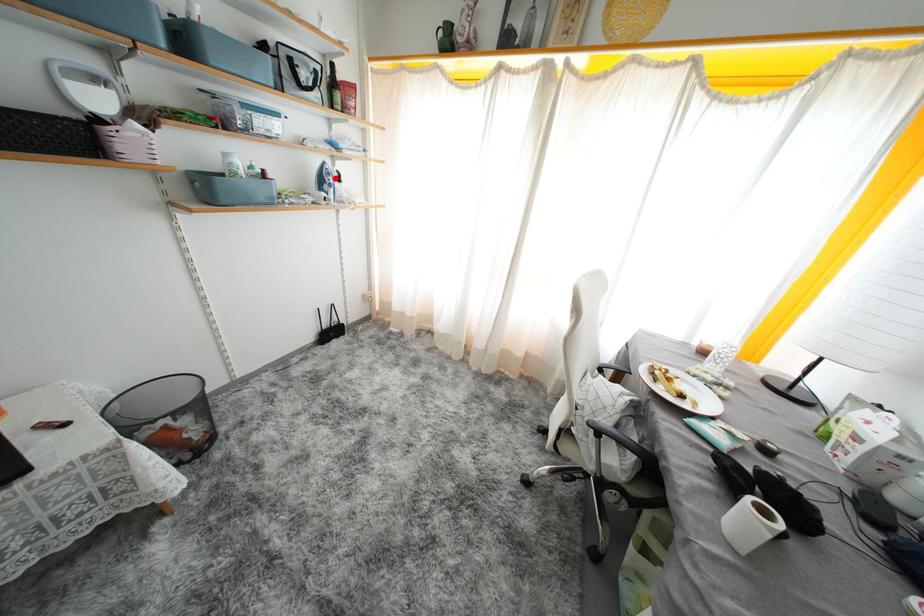
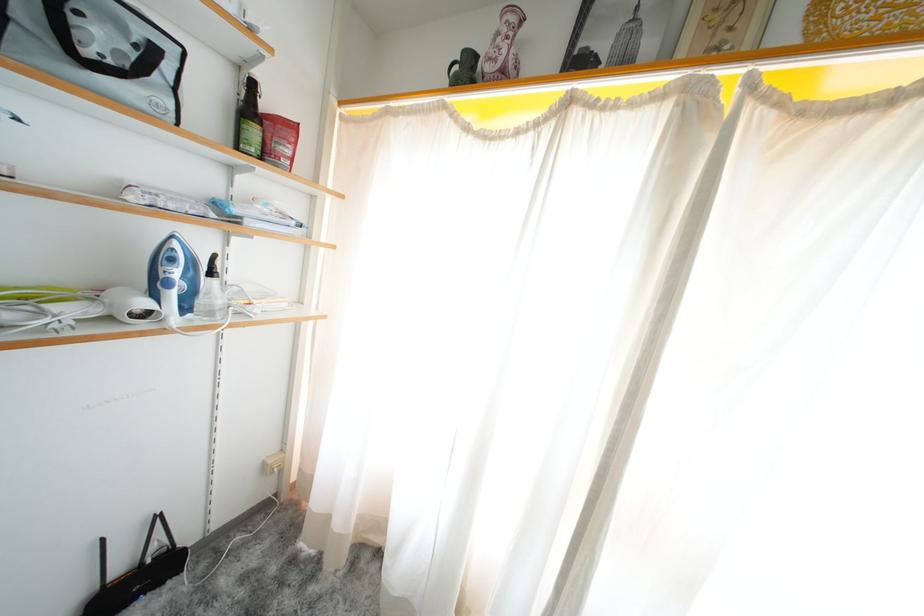
Question: I am providing you with two images of the same scene from different viewpoints. A red point is shown in image1. For the corresponding object point in image2, is it positioned nearer or farther from the camera?

Choices:
 (A) Nearer
 (B) Farther

Answer: (B)